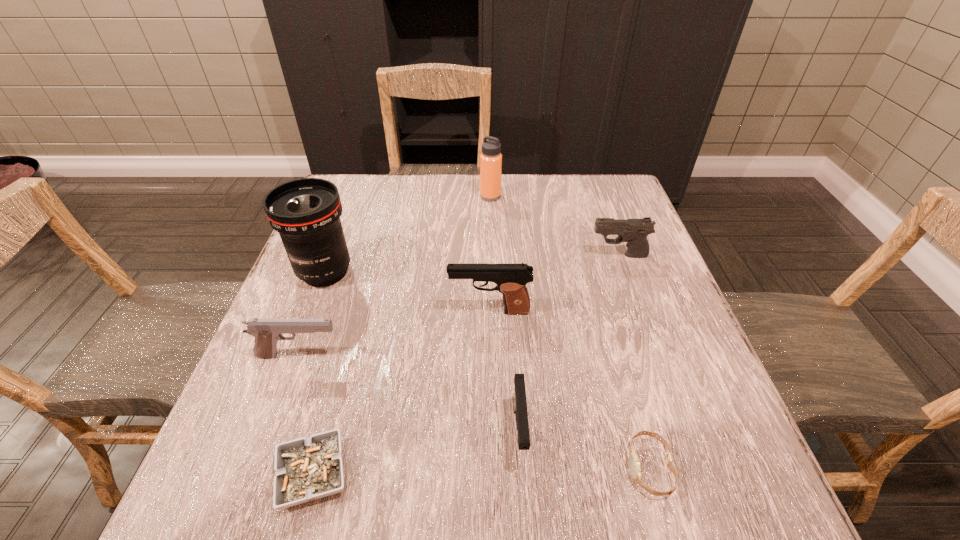
Locate an element on the screen. telephoto lens present at the left edge is located at coordinates (306, 212).

Locate an element on the screen. The height and width of the screenshot is (540, 960). pistol that is positioned at the left edge is located at coordinates (267, 332).

Locate an element on the screen. This screenshot has height=540, width=960. ashtray situated at the left edge is located at coordinates (307, 469).

At what (x,y) coordinates should I click in order to perform the action: click on pistol present at the right edge. Please return your answer as a coordinate pair (x, y). This screenshot has width=960, height=540. Looking at the image, I should click on [633, 231].

This screenshot has height=540, width=960. What are the coordinates of `watch at the right edge` in the screenshot? It's located at (634, 463).

This screenshot has height=540, width=960. What are the coordinates of `object at the near left corner` in the screenshot? It's located at (307, 469).

I want to click on object present at the near right corner, so click(634, 463).

Locate an element on the screen. This screenshot has height=540, width=960. vacant space at the far edge of the desktop is located at coordinates (471, 184).

Locate an element on the screen. The height and width of the screenshot is (540, 960). free space at the left edge of the desktop is located at coordinates (338, 343).

Image resolution: width=960 pixels, height=540 pixels. Identify the location of vacant area at the right edge of the desktop. (660, 449).